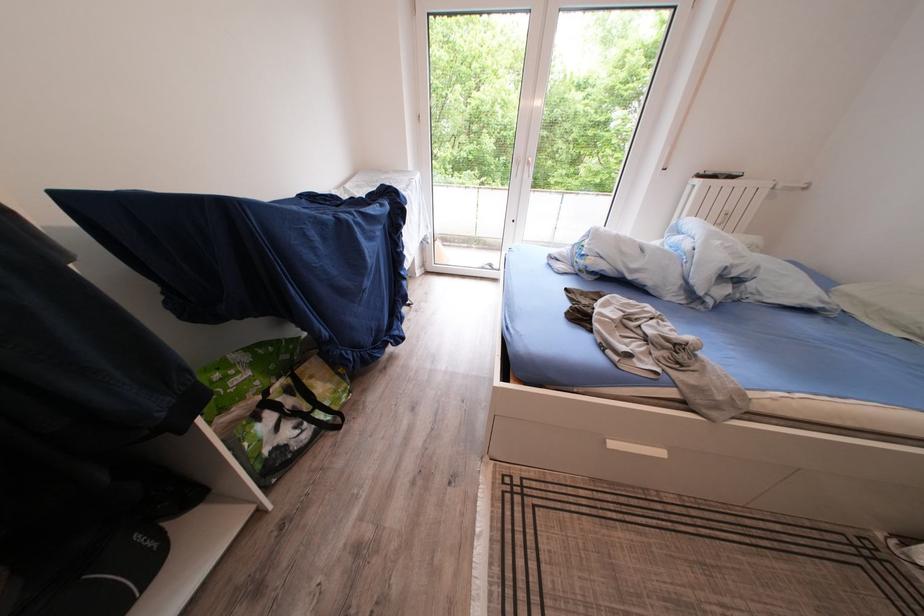
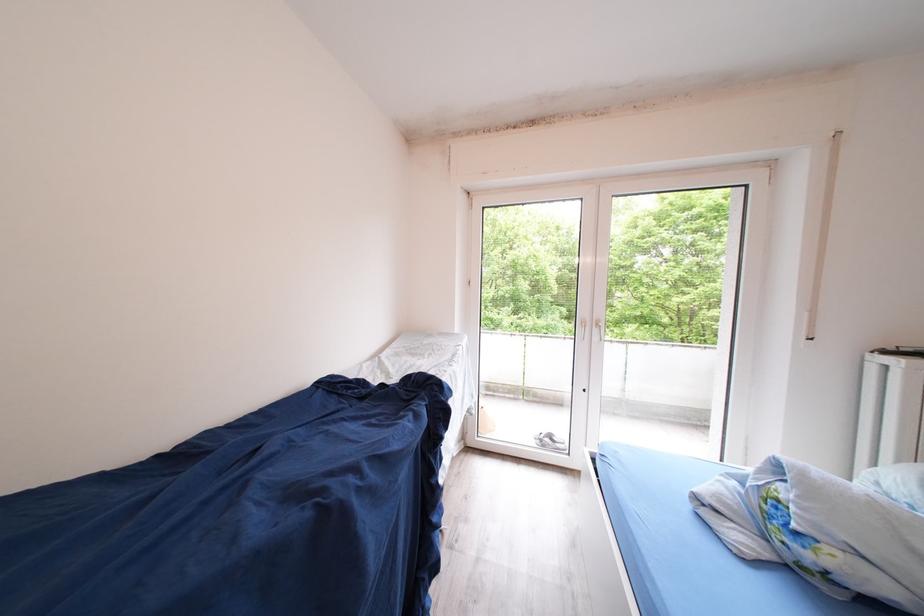
Question: Based on the continuous images, in which direction is the camera rotating? Reply with the corresponding letter.

Choices:
 (A) Left
 (B) Right
 (C) Up
 (D) Down

Answer: (C)